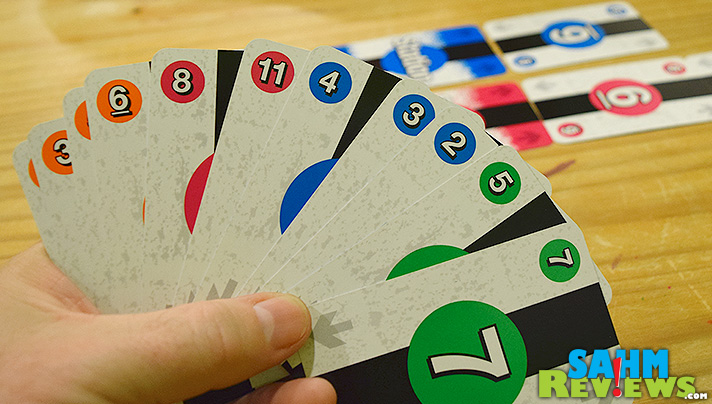
You are a GUI agent. You are given a task and a screenshot of the screen. Output one action in this format:
    pyautogui.click(x=<x>, y=<y>)
    Task: Click on the wood table
    The width and height of the screenshot is (712, 404).
    Given the screenshot: What is the action you would take?
    pyautogui.click(x=607, y=203)